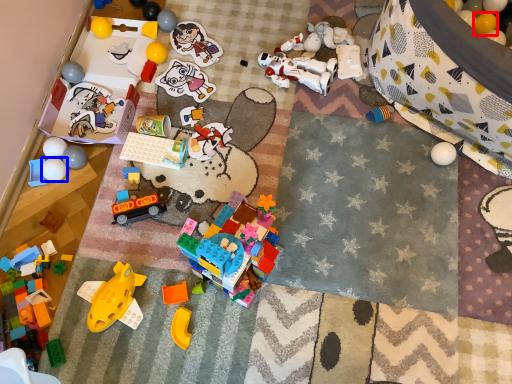
Question: Which point is closer to the camera, toy (highlighted by a red box) or toy (highlighted by a blue box)?

Choices:
 (A) toy
 (B) toy

Answer: (B)